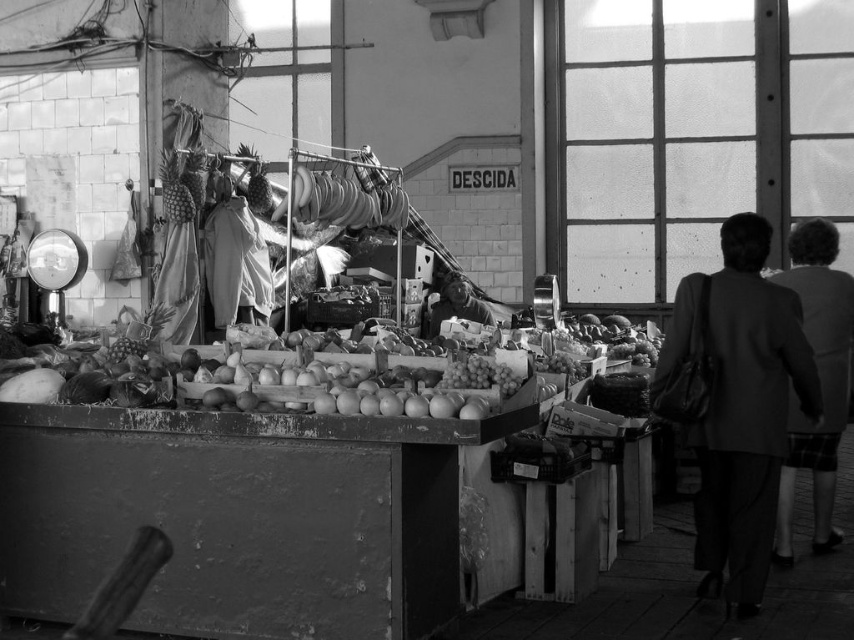
Is smooth wooden crate at center shorter than dark gray suit at right?

Indeed, smooth wooden crate at center has a lesser height compared to dark gray suit at right.

Between point (305, 346) and point (717, 522), which one is positioned behind?

The point (717, 522) is behind.

What do you see at coordinates (313, 374) in the screenshot? Image resolution: width=854 pixels, height=640 pixels. I see `smooth wooden crate at center` at bounding box center [313, 374].

Find the location of a particular element. The image size is (854, 640). smooth wooden crate at center is located at coordinates (313, 374).

Between dark gray suit at right and plaid skirt at right, which one appears on the left side from the viewer's perspective?

dark gray suit at right is more to the left.

Is dark gray suit at right taller than plaid skirt at right?

No.

This screenshot has height=640, width=854. What do you see at coordinates (738, 404) in the screenshot?
I see `dark gray suit at right` at bounding box center [738, 404].

At what (x,y) coordinates should I click in order to perform the action: click on dark gray suit at right. Please return your answer as a coordinate pair (x, y). The width and height of the screenshot is (854, 640). Looking at the image, I should click on (738, 404).

Does smooth wooden crate at center come behind smooth skin face at center?

That is False.

Who is lower down, smooth wooden crate at center or smooth skin face at center?

smooth wooden crate at center is lower down.

Is point (449, 410) positioned before point (455, 301)?

Yes.

You are a GUI agent. You are given a task and a screenshot of the screen. Output one action in this format:
    pyautogui.click(x=<x>, y=<y>)
    Task: Click on the smooth wooden crate at center
    Image resolution: width=854 pixels, height=640 pixels.
    Given the screenshot: What is the action you would take?
    pyautogui.click(x=313, y=374)